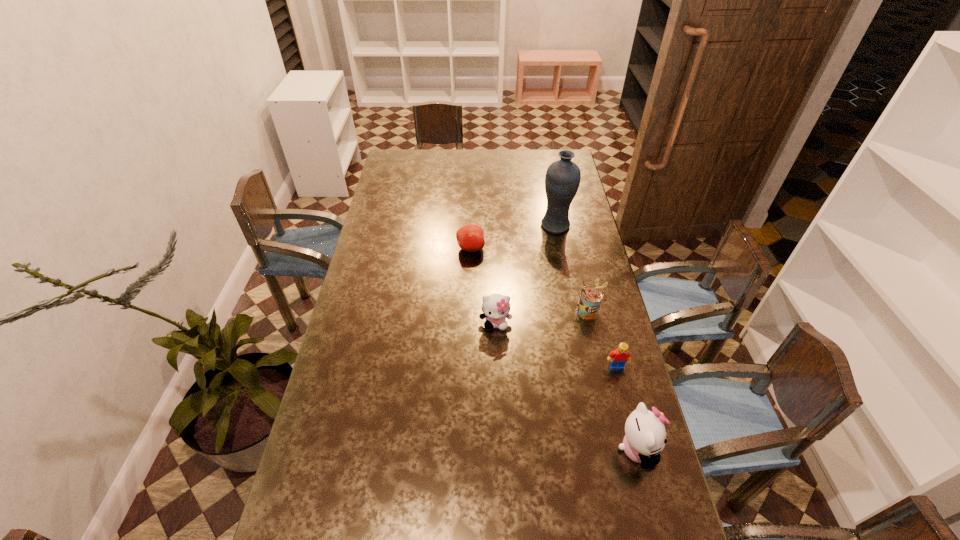
This screenshot has width=960, height=540. What are the coordinates of `vacant space located 0.400m on the back of the can` in the screenshot? It's located at (569, 230).

Locate an element on the screen. vacant position located 0.210m on the left of the second farthest object is located at coordinates (404, 248).

Image resolution: width=960 pixels, height=540 pixels. I want to click on vacant position located 0.250m on the front of the farthest object, so click(566, 279).

Identify the location of vacant space located 0.400m on the face of the second nearest object. Image resolution: width=960 pixels, height=540 pixels. (653, 510).

Image resolution: width=960 pixels, height=540 pixels. I want to click on kitten located in the right edge section of the desktop, so click(x=645, y=437).

The image size is (960, 540). What are the coordinates of `can at the right edge` in the screenshot? It's located at (590, 299).

Where is `vase that is at the right edge`? vase that is at the right edge is located at coordinates (562, 180).

Locate an element on the screen. This screenshot has width=960, height=540. Lego located at the right edge is located at coordinates (618, 358).

Locate an element on the screen. free space at the far edge is located at coordinates (482, 154).

In the image, there is a desktop. Where is `vacant region at the left edge`? vacant region at the left edge is located at coordinates (395, 257).